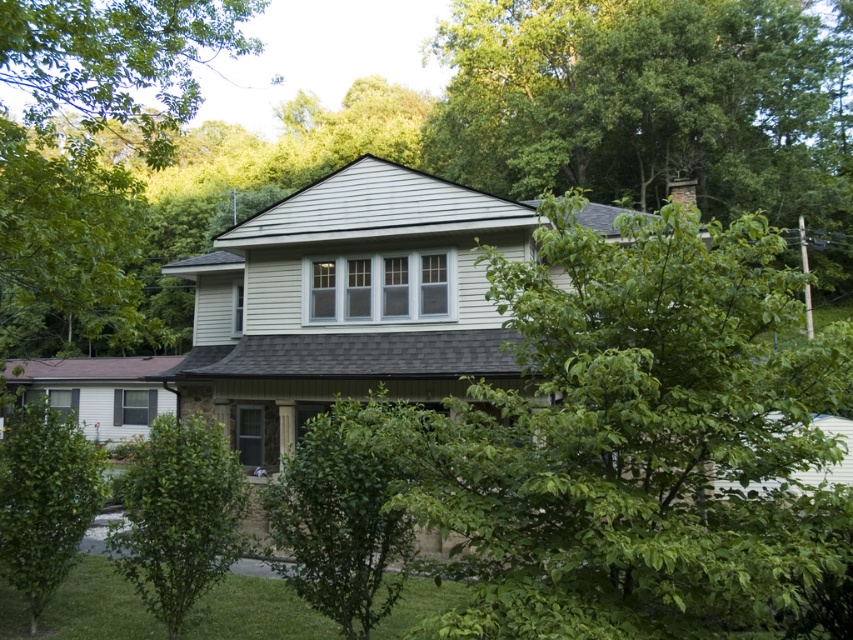
You are standing in front of the house and see a point marked at coordinates (x=646, y=442). What object is located at that point?

The point at coordinates (x=646, y=442) indicates a green leafy tree at center.

You are a gardener who needs to place a 7 feet long decorative fence between the green leafy hedge at center and the green leafy bush at lower left. Can you fit the fence between them without overlapping either plant?

The green leafy hedge at center is 6.76 feet from the green leafy bush at lower left. Since the fence is 7 feet long, it cannot fit between them without overlapping one of the plants as the distance is slightly less than the fence length.

You are a gardener planning to trim the green leafy hedge at center and the green leafy bush at lower left. Which of the two plants requires more effort to trim based on their sizes?

The green leafy bush at lower left requires more effort to trim because it is larger than the green leafy hedge at center.